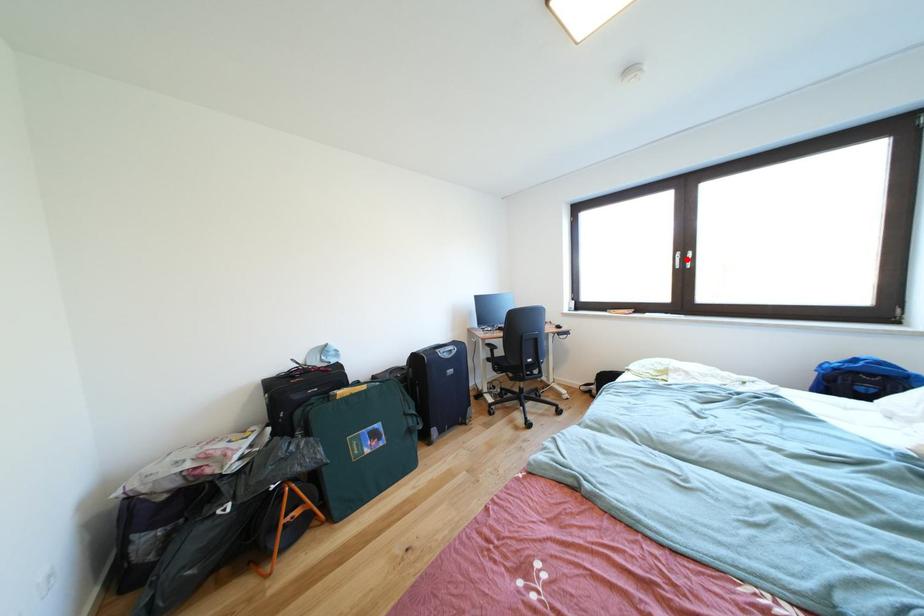
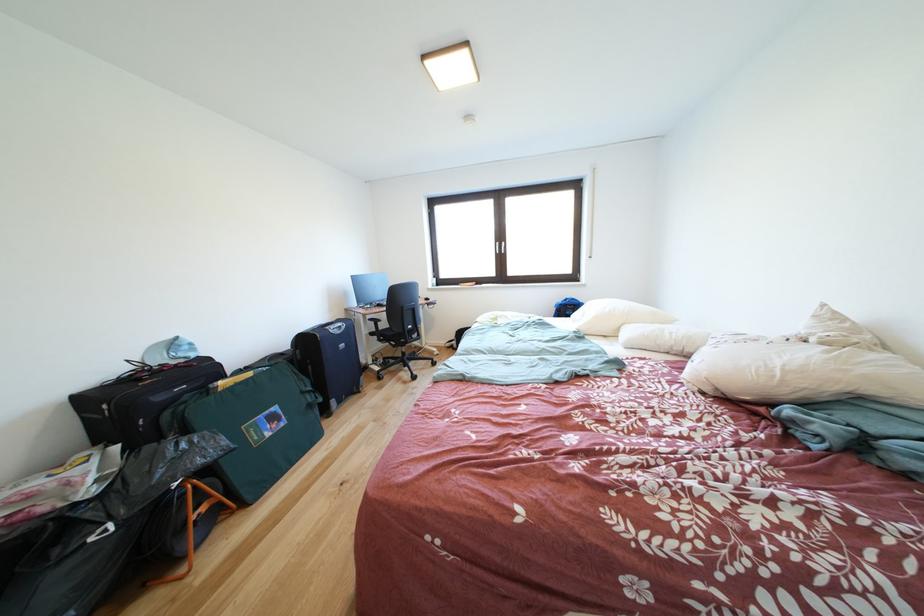
Find the pixel in the second image that matches the highlighted location in the first image.

(505, 249)